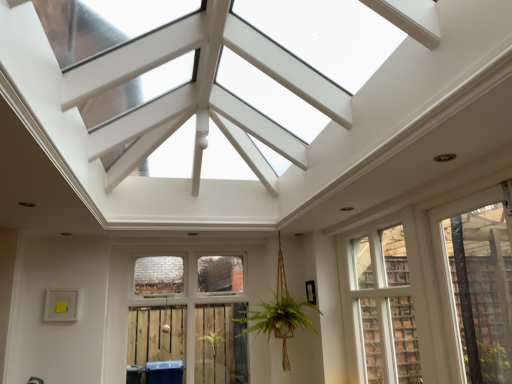
Question: Is transparent plastic window at right, the 3th window positioned from the left, taller or shorter than clear glass window at center, which appears as the third window when viewed from the right?

Choices:
 (A) short
 (B) tall

Answer: (A)

Question: Is transparent plastic window at right, the 3th window positioned from the left, in front of or behind clear glass window at center, which appears as the third window when viewed from the right, in the image?

Choices:
 (A) behind
 (B) front

Answer: (B)

Question: Which object is the farthest from the white wood window at center, marked as the second window in a left-to-right arrangement?

Choices:
 (A) clear glass window at center, arranged as the first window when viewed from the left
 (B) transparent plastic window at right, the first window positioned from the right

Answer: (A)

Question: Considering the real-world distances, which object is farthest from the clear glass window at center, arranged as the first window when viewed from the left?

Choices:
 (A) transparent plastic window at right, the 3th window positioned from the left
 (B) white wood window at center, the second window from the right

Answer: (A)